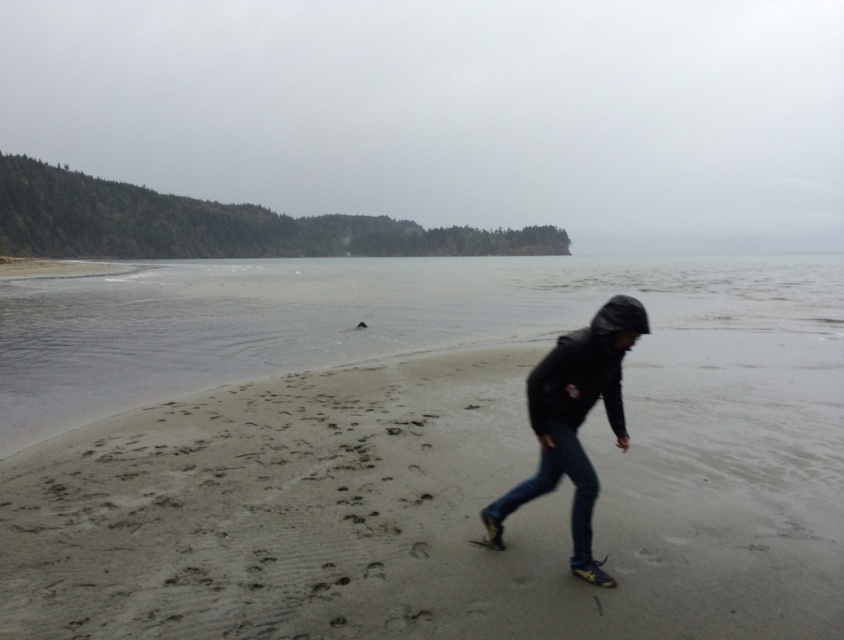
Question: Which object is closer to the camera taking this photo?

Choices:
 (A) dark blue jeans at lower center
 (B) sandy beach at center

Answer: (B)

Question: Is sandy beach at center above dark blue jeans at lower center?

Choices:
 (A) yes
 (B) no

Answer: (B)

Question: Does sandy beach at center appear under dark blue jeans at lower center?

Choices:
 (A) yes
 (B) no

Answer: (A)

Question: Can you confirm if sandy beach at center is positioned to the right of dark blue jeans at lower center?

Choices:
 (A) yes
 (B) no

Answer: (A)

Question: Which object appears closest to the camera in this image?

Choices:
 (A) dark blue jeans at lower center
 (B) sandy beach at center

Answer: (B)

Question: Which point is farther to the camera?

Choices:
 (A) (545, 422)
 (B) (207, 422)

Answer: (B)